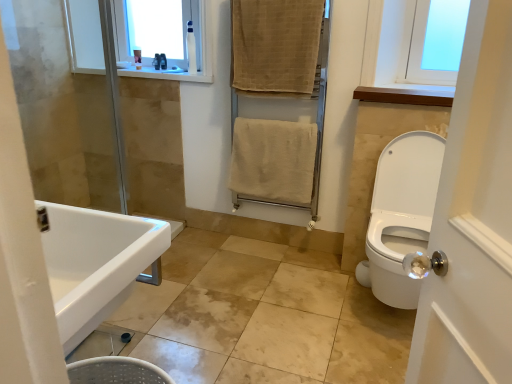
Question: Is the depth of translucent plastic soap dispenser at upper left, the second toiletry when ordered from left to right, less than that of clear plastic bottle at upper center, the first toiletry in the left-to-right sequence?

Choices:
 (A) yes
 (B) no

Answer: (B)

Question: From a real-world perspective, is translucent plastic soap dispenser at upper left, which ranks as the 2th toiletry in right-to-left order, physically above clear plastic bottle at upper center, which is the 3th toiletry from right to left?

Choices:
 (A) yes
 (B) no

Answer: (B)

Question: Would you say translucent plastic soap dispenser at upper left, the second toiletry when ordered from left to right, is outside clear plastic bottle at upper center, which is the 3th toiletry from right to left?

Choices:
 (A) no
 (B) yes

Answer: (B)

Question: Does translucent plastic soap dispenser at upper left, the second toiletry when ordered from left to right, appear on the right side of clear plastic bottle at upper center, which is the 3th toiletry from right to left?

Choices:
 (A) no
 (B) yes

Answer: (B)

Question: Are translucent plastic soap dispenser at upper left, the second toiletry when ordered from left to right, and clear plastic bottle at upper center, which is the 2th toiletry from front to back, far apart?

Choices:
 (A) yes
 (B) no

Answer: (B)

Question: Could you tell me if translucent plastic soap dispenser at upper left, the second toiletry when ordered from left to right, is facing clear plastic bottle at upper center, the 2th toiletry in the back-to-front sequence?

Choices:
 (A) no
 (B) yes

Answer: (B)

Question: Is beige cotton towel at center, positioned as the first bath towel in bottom-to-top order, not close to beige textured towel rack at center?

Choices:
 (A) yes
 (B) no

Answer: (B)

Question: From the image's perspective, is beige cotton towel at center, which appears as the 2th bath towel when viewed from the top, above beige textured towel rack at center?

Choices:
 (A) no
 (B) yes

Answer: (A)

Question: Is beige cotton towel at center, positioned as the first bath towel in bottom-to-top order, further to the viewer compared to beige textured towel rack at center?

Choices:
 (A) no
 (B) yes

Answer: (B)

Question: Is beige cotton towel at center, which appears as the 2th bath towel when viewed from the top, thinner than beige textured towel rack at center?

Choices:
 (A) yes
 (B) no

Answer: (A)

Question: Is beige cotton towel at center, positioned as the first bath towel in bottom-to-top order, facing towards beige textured towel rack at center?

Choices:
 (A) yes
 (B) no

Answer: (A)

Question: Is beige cotton towel at center, which appears as the 2th bath towel when viewed from the top, to the left of beige textured towel rack at center from the viewer's perspective?

Choices:
 (A) yes
 (B) no

Answer: (A)

Question: Is beige textured towel at upper center, the second bath towel in the bottom-to-top sequence, positioned beyond the bounds of white glossy sink at lower left?

Choices:
 (A) no
 (B) yes

Answer: (B)